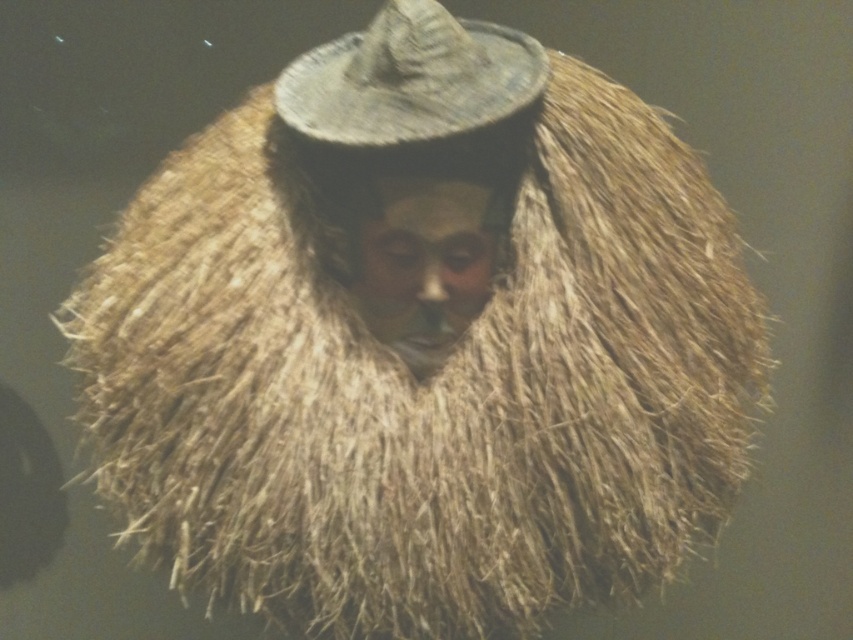
Question: From the image, what is the correct spatial relationship of natural straw hat at center in relation to smooth tan face at center?

Choices:
 (A) left
 (B) right

Answer: (A)

Question: Is natural straw hat at center thinner than smooth tan face at center?

Choices:
 (A) no
 (B) yes

Answer: (A)

Question: Which of the following is the farthest from the observer?

Choices:
 (A) smooth tan face at center
 (B) natural straw hat at center

Answer: (A)

Question: Which point is closer to the camera?

Choices:
 (A) natural straw hat at center
 (B) smooth tan face at center

Answer: (A)

Question: Considering the relative positions of natural straw hat at center and smooth tan face at center in the image provided, where is natural straw hat at center located with respect to smooth tan face at center?

Choices:
 (A) below
 (B) above

Answer: (B)

Question: Which point is closer to the camera?

Choices:
 (A) (419, 116)
 (B) (392, 196)

Answer: (A)